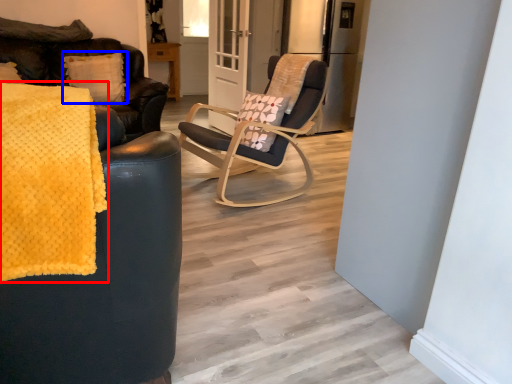
Question: Among these objects, which one is nearest to the camera, blanket (highlighted by a red box) or pillow (highlighted by a blue box)?

Choices:
 (A) blanket
 (B) pillow

Answer: (A)